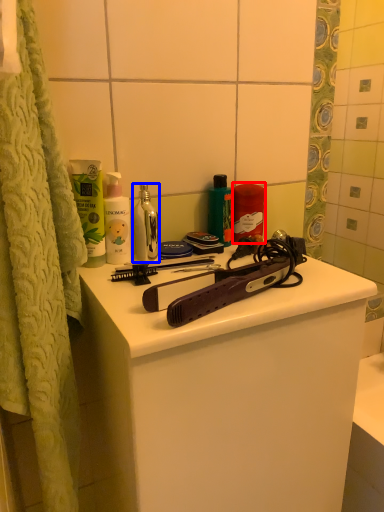
Question: Which object is closer to the camera taking this photo, cleaning product (highlighted by a red box) or mouthwash (highlighted by a blue box)?

Choices:
 (A) cleaning product
 (B) mouthwash

Answer: (B)